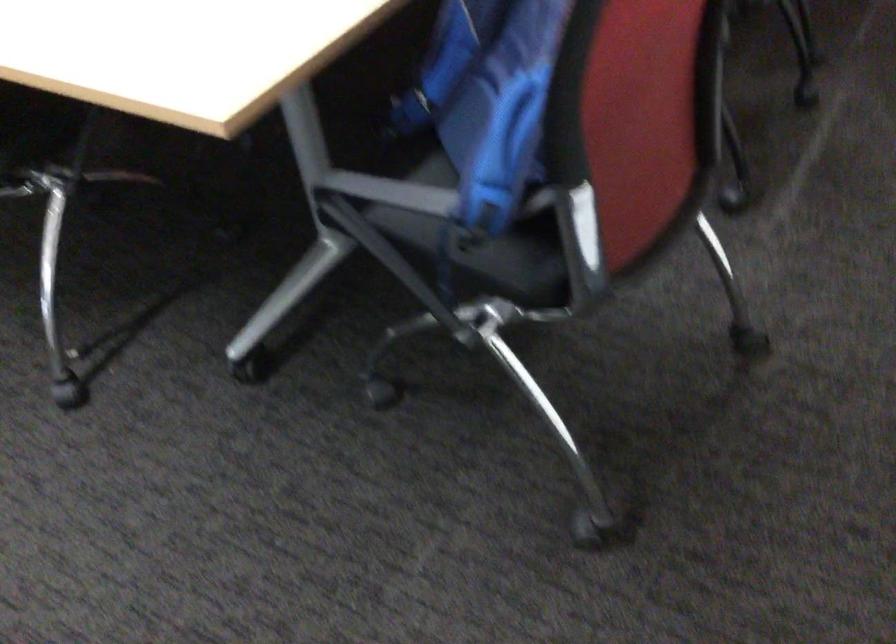
Find the location of a particular element. The height and width of the screenshot is (644, 896). blue backpack is located at coordinates (487, 98).